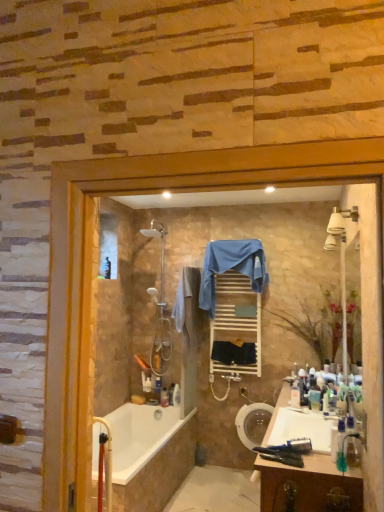
Question: From a real-world perspective, is white glossy sink at lower right physically above polished chrome shower at center?

Choices:
 (A) yes
 (B) no

Answer: (B)

Question: Is the depth of white glossy sink at lower right greater than that of polished chrome shower at center?

Choices:
 (A) no
 (B) yes

Answer: (A)

Question: Is white glossy sink at lower right closer to camera compared to polished chrome shower at center?

Choices:
 (A) no
 (B) yes

Answer: (B)

Question: Would you say white glossy sink at lower right contains polished chrome shower at center?

Choices:
 (A) yes
 (B) no

Answer: (B)

Question: From the image's perspective, is white glossy sink at lower right under polished chrome shower at center?

Choices:
 (A) no
 (B) yes

Answer: (B)

Question: Considering the relative sizes of white glossy sink at lower right and polished chrome shower at center in the image provided, is white glossy sink at lower right smaller than polished chrome shower at center?

Choices:
 (A) no
 (B) yes

Answer: (B)

Question: Can you confirm if beige cotton bath towel at center, placed as the 1th bath towel when sorted from left to right, is taller than white wooden towel rack at center?

Choices:
 (A) no
 (B) yes

Answer: (A)

Question: Are beige cotton bath towel at center, acting as the 3th bath towel starting from the right, and white wooden towel rack at center far apart?

Choices:
 (A) yes
 (B) no

Answer: (B)

Question: Can you confirm if beige cotton bath towel at center, acting as the 3th bath towel starting from the right, is bigger than white wooden towel rack at center?

Choices:
 (A) no
 (B) yes

Answer: (B)

Question: Is beige cotton bath towel at center, acting as the 3th bath towel starting from the right, positioned behind white wooden towel rack at center?

Choices:
 (A) yes
 (B) no

Answer: (B)

Question: Is beige cotton bath towel at center, acting as the 3th bath towel starting from the right, placed right next to white wooden towel rack at center?

Choices:
 (A) yes
 (B) no

Answer: (B)

Question: Can you confirm if beige cotton bath towel at center, acting as the 3th bath towel starting from the right, is thinner than white wooden towel rack at center?

Choices:
 (A) no
 (B) yes

Answer: (A)

Question: Are white wooden towel rack at center and translucent plastic toothbrush at lower right, which is the second toiletry from right to left, beside each other?

Choices:
 (A) yes
 (B) no

Answer: (B)